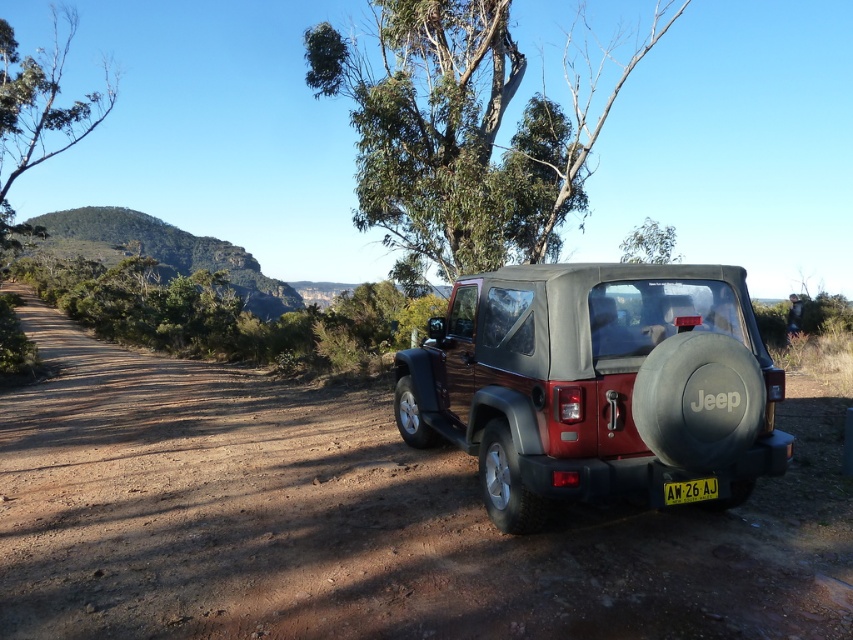
You are planning to drive a small toy car that is 10 cm tall over the dirt field at center and the matte black jeep at right. Which surface would be easier for the toy car to navigate based on their heights?

The dirt field at center has lesser height compared to the matte black jeep at right, so the toy car would find it easier to navigate the dirt field at center since it is lower.